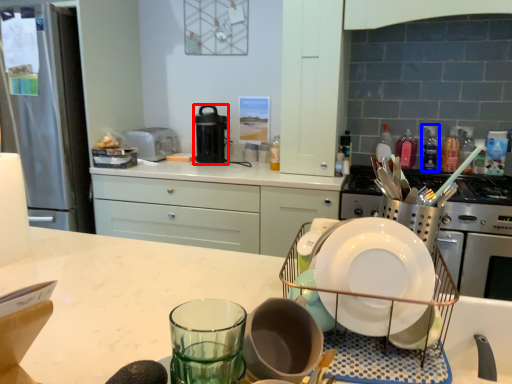
Question: Which object appears closest to the camera in this image, kitchen appliance (highlighted by a red box) or bottle (highlighted by a blue box)?

Choices:
 (A) kitchen appliance
 (B) bottle

Answer: (B)